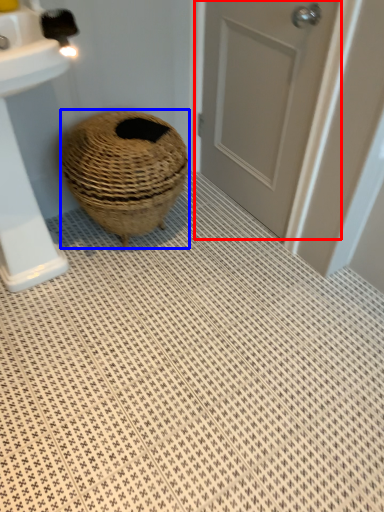
Question: Among these objects, which one is nearest to the camera, door (highlighted by a red box) or basket (highlighted by a blue box)?

Choices:
 (A) door
 (B) basket

Answer: (A)